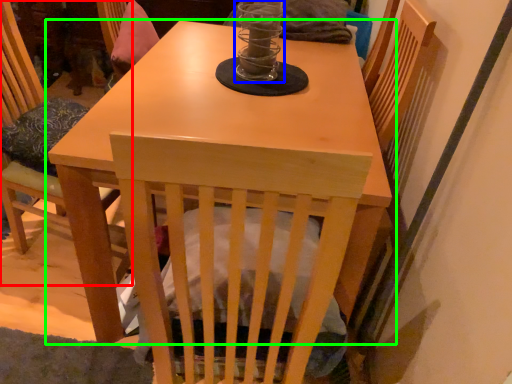
Question: Which object is positioned farthest from chair (highlighted by a red box)? Select from candle holder (highlighted by a blue box) and table (highlighted by a green box).

Choices:
 (A) candle holder
 (B) table

Answer: (A)